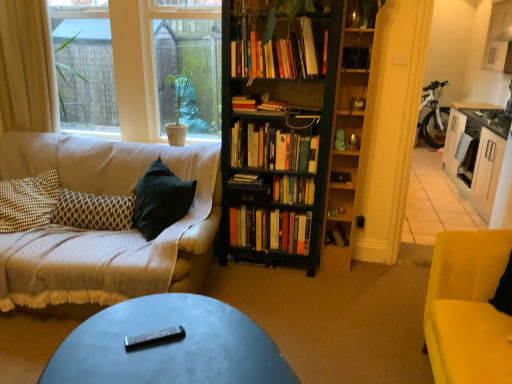
The width and height of the screenshot is (512, 384). Identify the location of vacant space in between wooden shelf at right and black wooden bookcase at center. (336, 271).